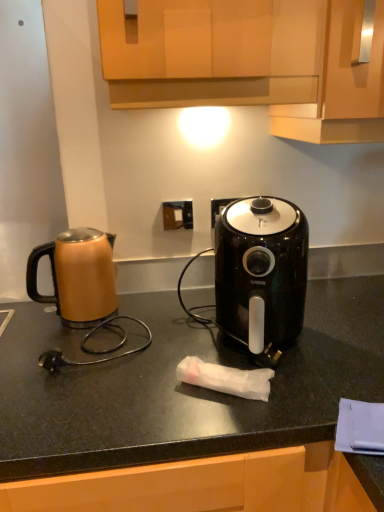
Question: From a real-world perspective, does matte brown kettle at left sit lower than black matte countertop at center?

Choices:
 (A) no
 (B) yes

Answer: (A)

Question: Does matte brown kettle at left have a larger size compared to black matte countertop at center?

Choices:
 (A) yes
 (B) no

Answer: (B)

Question: Is matte brown kettle at left turned away from black matte countertop at center?

Choices:
 (A) yes
 (B) no

Answer: (B)

Question: Is matte brown kettle at left oriented towards black matte countertop at center?

Choices:
 (A) no
 (B) yes

Answer: (A)

Question: Are matte brown kettle at left and black matte countertop at center far apart?

Choices:
 (A) no
 (B) yes

Answer: (A)

Question: Relative to wooden cabinet at upper center, the second cabinetry from the left, is wooden cabinet at upper center, arranged as the second cabinetry when viewed from the right, in front or behind?

Choices:
 (A) front
 (B) behind

Answer: (A)

Question: From the image's perspective, is wooden cabinet at upper center, arranged as the second cabinetry when viewed from the right, located above or below wooden cabinet at upper center, the second cabinetry from the left?

Choices:
 (A) above
 (B) below

Answer: (A)

Question: In terms of height, does wooden cabinet at upper center, arranged as the second cabinetry when viewed from the right, look taller or shorter compared to wooden cabinet at upper center, the second cabinetry from the left?

Choices:
 (A) tall
 (B) short

Answer: (B)

Question: From a real-world perspective, is wooden cabinet at upper center, arranged as the 1th cabinetry when viewed from the left, above or below wooden cabinet at upper center, which appears as the first cabinetry when viewed from the right?

Choices:
 (A) above
 (B) below

Answer: (A)

Question: From a real-world perspective, is matte brown kettle at left physically located above or below black matte countertop at center?

Choices:
 (A) above
 (B) below

Answer: (A)

Question: Is matte brown kettle at left taller or shorter than black matte countertop at center?

Choices:
 (A) tall
 (B) short

Answer: (B)

Question: Is point 97,288 positioned closer to the camera than point 279,391?

Choices:
 (A) farther
 (B) closer

Answer: (A)

Question: From the image's perspective, is matte brown kettle at left above or below black matte countertop at center?

Choices:
 (A) above
 (B) below

Answer: (A)

Question: From a real-world perspective, is white plastic electric outlet at center positioned above or below black matte countertop at center?

Choices:
 (A) below
 (B) above

Answer: (B)

Question: Is white plastic electric outlet at center taller or shorter than black matte countertop at center?

Choices:
 (A) tall
 (B) short

Answer: (B)